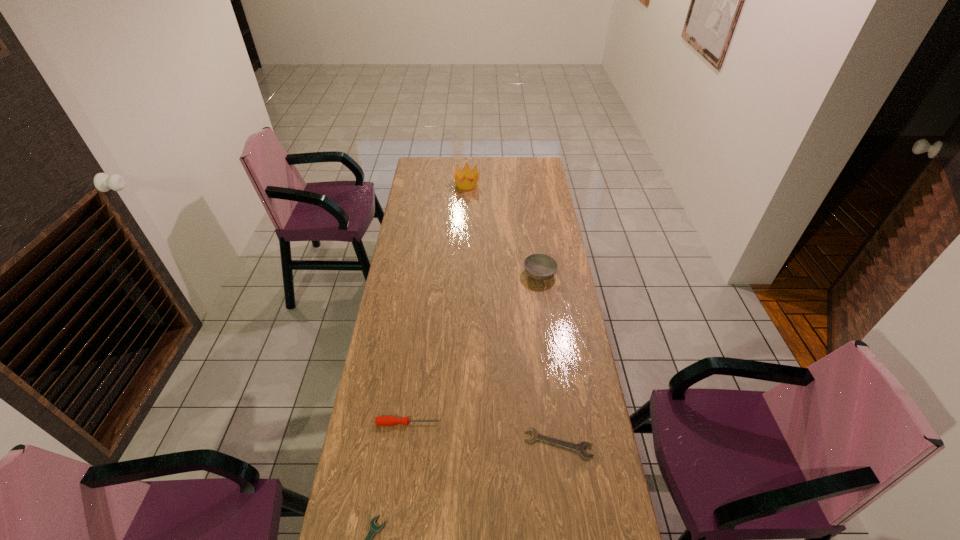
Identify the location of free space that satisfies the following two spatial constraints: 1. on the back side of the farther wrench; 2. on the left side of the bowl. (536, 274).

The height and width of the screenshot is (540, 960). I want to click on free space that satisfies the following two spatial constraints: 1. on the front side of the bowl; 2. on the right side of the crown, so click(463, 274).